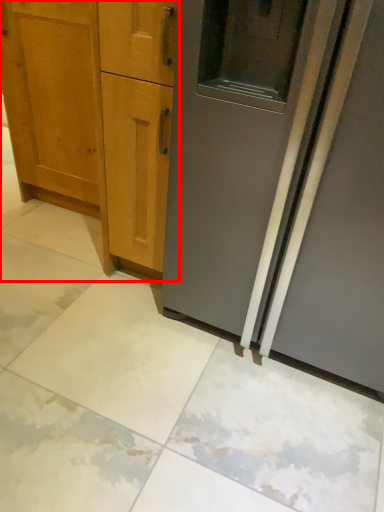
Question: From the image's perspective, where is cabinetry (annotated by the red box) located in relation to door in the image?

Choices:
 (A) above
 (B) below

Answer: (A)